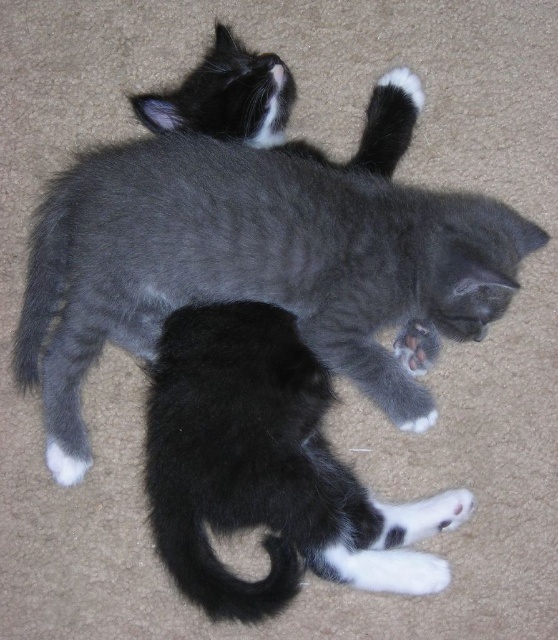
You are a photographer taking a picture of two kittens lying on a beige carpeted floor. You notice two points marked in the scene. Which point, point (355, 349) or point (401, 352), is closer to you?

Point (355, 349) is closer to the viewer than point (401, 352).

You are a cat owner who wants to place a small toy between the soft gray fur cat at center and the white fur at lower center. Can you fit the toy if it is 10 inches long?

The distance between the soft gray fur cat at center and the white fur at lower center is 12.05 inches. Since the toy is 10 inches long, it can fit between them with some space to spare.